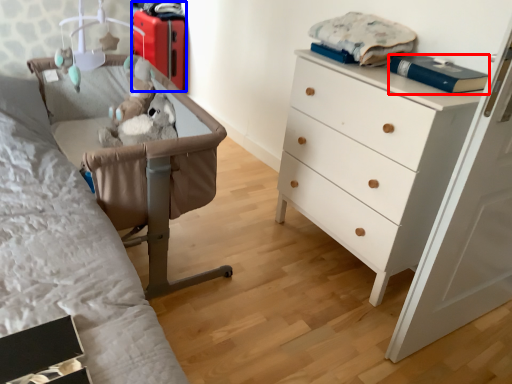
Question: Which of the following is the closest to the observer, book (highlighted by a red box) or luggage (highlighted by a blue box)?

Choices:
 (A) book
 (B) luggage

Answer: (A)